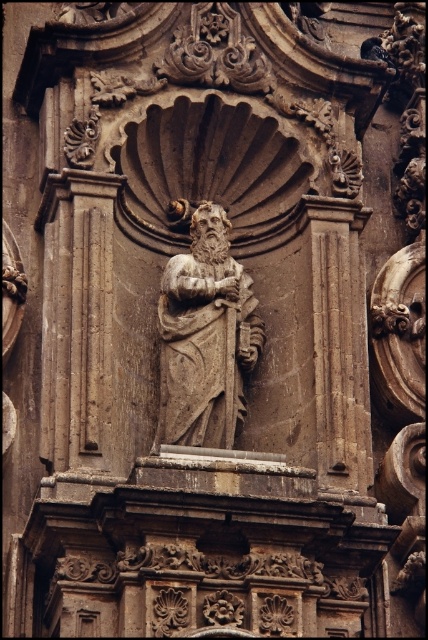
Can you confirm if brown stone statue at center is positioned above smooth stone column at center?

Actually, brown stone statue at center is below smooth stone column at center.

Find the location of a particular element. Image resolution: width=428 pixels, height=640 pixels. brown stone statue at center is located at coordinates (205, 337).

Find the location of a particular element. The image size is (428, 640). brown stone statue at center is located at coordinates (205, 337).